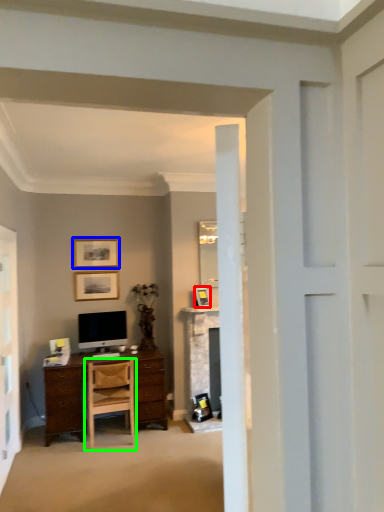
Question: Estimate the real-world distances between objects in this image. Which object is closer to picture frame (highlighted by a red box), picture frame (highlighted by a blue box) or chair (highlighted by a green box)?

Choices:
 (A) picture frame
 (B) chair

Answer: (A)